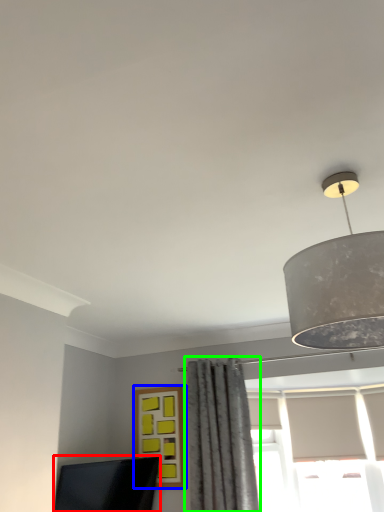
Question: Based on their relative distances, which object is farther from computer monitor (highlighted by a red box)? Choose from window (highlighted by a blue box) and curtain (highlighted by a green box).

Choices:
 (A) window
 (B) curtain

Answer: (B)